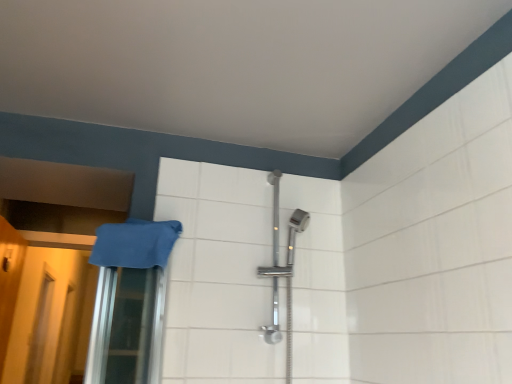
Identify the location of translucent plastic screen door at lower left, the second screen door in the left-to-right sequence. (45, 317).

This screenshot has width=512, height=384. What do you see at coordinates (45, 317) in the screenshot? I see `translucent plastic screen door at lower left, marked as the 2th screen door in a back-to-front arrangement` at bounding box center [45, 317].

Describe the element at coordinates (9, 280) in the screenshot. Image resolution: width=512 pixels, height=384 pixels. I see `yellow matte door at left` at that location.

Locate an element on the screen. Image resolution: width=512 pixels, height=384 pixels. translucent plastic screen door at lower left, the 1th screen door viewed from the back is located at coordinates (39, 330).

Describe the element at coordinates (39, 330) in the screenshot. This screenshot has width=512, height=384. I see `translucent plastic screen door at lower left, which is counted as the second screen door, starting from the front` at that location.

Measure the distance between blue fabric towel at left and camera.

blue fabric towel at left is 4.40 feet from camera.

Image resolution: width=512 pixels, height=384 pixels. I want to click on translucent plastic screen door at lower left, the second screen door in the left-to-right sequence, so click(45, 317).

Is translucent plastic screen door at lower left, the 1th screen door when ordered from front to back, oriented away from yellow matte door at left?

No, translucent plastic screen door at lower left, the 1th screen door when ordered from front to back,'s orientation is not away from yellow matte door at left.

From a real-world perspective, which is physically above, translucent plastic screen door at lower left, the second screen door in the left-to-right sequence, or yellow matte door at left?

From a 3D spatial view, translucent plastic screen door at lower left, the second screen door in the left-to-right sequence, is above.

How different are the orientations of translucent plastic screen door at lower left, the second screen door in the left-to-right sequence, and yellow matte door at left in degrees?

The angle between the facing direction of translucent plastic screen door at lower left, the second screen door in the left-to-right sequence, and the facing direction of yellow matte door at left is 90.7 degrees.

Does translucent plastic screen door at lower left, the first screen door when ordered from right to left, have a lesser height compared to yellow matte door at left?

In fact, translucent plastic screen door at lower left, the first screen door when ordered from right to left, may be taller than yellow matte door at left.

From a real-world perspective, is yellow matte door at left physically located above or below blue fabric towel at left?

yellow matte door at left is below blue fabric towel at left.

Is yellow matte door at left taller or shorter than blue fabric towel at left?

Clearly, yellow matte door at left is taller compared to blue fabric towel at left.

From the image's perspective, would you say yellow matte door at left is shown under blue fabric towel at left?

Yes.

Is translucent plastic screen door at lower left, acting as the 2th screen door starting from the right, oriented away from yellow matte door at left?

No, translucent plastic screen door at lower left, acting as the 2th screen door starting from the right,'s orientation is not away from yellow matte door at left.

From the picture: Relative to yellow matte door at left, is translucent plastic screen door at lower left, which is counted as the second screen door, starting from the front, in front or behind?

translucent plastic screen door at lower left, which is counted as the second screen door, starting from the front, is positioned farther from the viewer than yellow matte door at left.

From the image's perspective, is translucent plastic screen door at lower left, which is the 1th screen door from left to right, located above or below yellow matte door at left?

From the image's perspective, translucent plastic screen door at lower left, which is the 1th screen door from left to right, appears below yellow matte door at left.

Which of these two, translucent plastic screen door at lower left, the 1th screen door viewed from the back, or yellow matte door at left, stands shorter?

yellow matte door at left.

Which is in front, point (20, 257) or point (71, 328)?

The point (20, 257) is closer to the camera.

Can you tell me how much yellow matte door at left and translucent plastic screen door at lower left, the second screen door in the left-to-right sequence, differ in facing direction?

The facing directions of yellow matte door at left and translucent plastic screen door at lower left, the second screen door in the left-to-right sequence, are 90.7 degrees apart.

Which of these two, yellow matte door at left or translucent plastic screen door at lower left, the second screen door in the left-to-right sequence, is thinner?

translucent plastic screen door at lower left, the second screen door in the left-to-right sequence, is thinner.

This screenshot has width=512, height=384. I want to click on door below the translucent plastic screen door at lower left, the first screen door when ordered from right to left (from a real-world perspective), so pyautogui.click(x=9, y=280).

Between blue fabric towel at left and yellow matte door at left, which one has smaller size?

blue fabric towel at left is smaller.

From a real-world perspective, is blue fabric towel at left physically located above or below yellow matte door at left?

A: Clearly, from a real-world perspective, blue fabric towel at left is above yellow matte door at left.

Between blue fabric towel at left and yellow matte door at left, which one is positioned in front?

blue fabric towel at left is in front.

Considering the positions of objects blue fabric towel at left and yellow matte door at left in the image provided, who is more to the left, blue fabric towel at left or yellow matte door at left?

yellow matte door at left.

Who is taller, blue fabric towel at left or translucent plastic screen door at lower left, the 1th screen door viewed from the back?

translucent plastic screen door at lower left, the 1th screen door viewed from the back.

Considering the sizes of objects blue fabric towel at left and translucent plastic screen door at lower left, acting as the 2th screen door starting from the right, in the image provided, who is thinner, blue fabric towel at left or translucent plastic screen door at lower left, acting as the 2th screen door starting from the right,?

translucent plastic screen door at lower left, acting as the 2th screen door starting from the right.

Which object is positioned more to the left, blue fabric towel at left or translucent plastic screen door at lower left, which is counted as the second screen door, starting from the front?

From the viewer's perspective, translucent plastic screen door at lower left, which is counted as the second screen door, starting from the front, appears more on the left side.

Between translucent plastic screen door at lower left, the 1th screen door when ordered from front to back, and blue fabric towel at left, which one has smaller size?

blue fabric towel at left is smaller.

Can we say translucent plastic screen door at lower left, the second screen door in the left-to-right sequence, lies outside blue fabric towel at left?

translucent plastic screen door at lower left, the second screen door in the left-to-right sequence, lies outside blue fabric towel at left's area.

Is translucent plastic screen door at lower left, the 1th screen door when ordered from front to back, with blue fabric towel at left?

No, translucent plastic screen door at lower left, the 1th screen door when ordered from front to back, is not in contact with blue fabric towel at left.

Considering the positions of point (33, 325) and point (164, 229), is point (33, 325) closer or farther from the camera than point (164, 229)?

Point (33, 325) appears to be farther away from the viewer than point (164, 229).

The image size is (512, 384). I want to click on door in front of the translucent plastic screen door at lower left, marked as the 2th screen door in a back-to-front arrangement, so click(x=9, y=280).

Where is `bath towel that appears on the right of yellow matte door at left`? bath towel that appears on the right of yellow matte door at left is located at coordinates (135, 243).

Based on their spatial positions, is translucent plastic screen door at lower left, the first screen door when ordered from right to left, or yellow matte door at left further from translucent plastic screen door at lower left, which is the 1th screen door from left to right?

yellow matte door at left is positioned further to the anchor translucent plastic screen door at lower left, which is the 1th screen door from left to right.

Considering their positions, is translucent plastic screen door at lower left, which is counted as the second screen door, starting from the front, positioned further to yellow matte door at left than translucent plastic screen door at lower left, the 1th screen door when ordered from front to back?

translucent plastic screen door at lower left, which is counted as the second screen door, starting from the front, is further to yellow matte door at left.

From the image, which object appears to be nearer to yellow matte door at left, blue fabric towel at left or translucent plastic screen door at lower left, the 1th screen door viewed from the back?

translucent plastic screen door at lower left, the 1th screen door viewed from the back, is positioned closer to the anchor yellow matte door at left.

When comparing their distances from translucent plastic screen door at lower left, marked as the 2th screen door in a back-to-front arrangement, does translucent plastic screen door at lower left, the 1th screen door viewed from the back, or blue fabric towel at left seem further?

Among the two, blue fabric towel at left is located further to translucent plastic screen door at lower left, marked as the 2th screen door in a back-to-front arrangement.

From the image, which object appears to be farther from translucent plastic screen door at lower left, the 1th screen door when ordered from front to back, translucent plastic screen door at lower left, the 1th screen door viewed from the back, or yellow matte door at left?

yellow matte door at left is positioned further to the anchor translucent plastic screen door at lower left, the 1th screen door when ordered from front to back.

From the image, which object appears to be nearer to translucent plastic screen door at lower left, the 1th screen door when ordered from front to back, yellow matte door at left or blue fabric towel at left?

Among the two, yellow matte door at left is located nearer to translucent plastic screen door at lower left, the 1th screen door when ordered from front to back.

Which object lies nearer to the anchor point blue fabric towel at left, yellow matte door at left or translucent plastic screen door at lower left, the 1th screen door viewed from the back?

yellow matte door at left is closer to blue fabric towel at left.

Considering their positions, is blue fabric towel at left positioned closer to translucent plastic screen door at lower left, the 1th screen door when ordered from front to back, than translucent plastic screen door at lower left, the 1th screen door viewed from the back?

Among the two, translucent plastic screen door at lower left, the 1th screen door viewed from the back, is located nearer to translucent plastic screen door at lower left, the 1th screen door when ordered from front to back.

Identify the location of door between blue fabric towel at left and translucent plastic screen door at lower left, the 1th screen door viewed from the back, from front to back. This screenshot has width=512, height=384. (9, 280).

Where is `screen door positioned between blue fabric towel at left and translucent plastic screen door at lower left, which is the 1th screen door from left to right, from near to far`? The height and width of the screenshot is (384, 512). screen door positioned between blue fabric towel at left and translucent plastic screen door at lower left, which is the 1th screen door from left to right, from near to far is located at coordinates (45, 317).

Where is `screen door between yellow matte door at left and translucent plastic screen door at lower left, the 1th screen door viewed from the back, along the z-axis`? screen door between yellow matte door at left and translucent plastic screen door at lower left, the 1th screen door viewed from the back, along the z-axis is located at coordinates (45, 317).

Identify the location of door between blue fabric towel at left and translucent plastic screen door at lower left, the first screen door when ordered from right to left, along the z-axis. (9, 280).